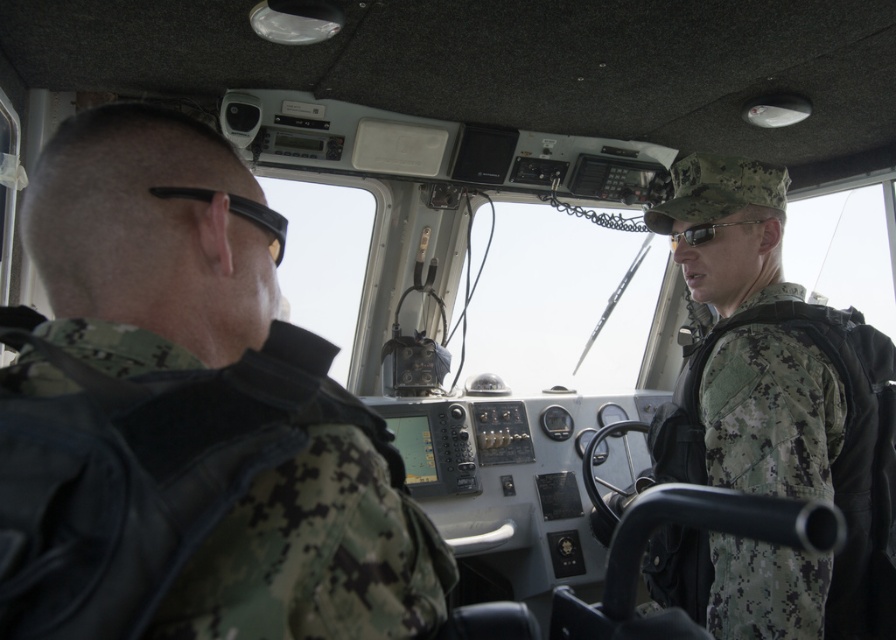
Question: Which of these objects is positioned farthest from the sunglasses at center?

Choices:
 (A) black rubber goggles at left
 (B) camouflage uniform at center

Answer: (A)

Question: From the image, what is the correct spatial relationship of camouflage uniform at left in relation to camouflage uniform at center?

Choices:
 (A) below
 (B) above

Answer: (B)

Question: Among these points, which one is nearest to the camera?

Choices:
 (A) (704, 362)
 (B) (274, 236)

Answer: (B)

Question: Which object is positioned closest to the camouflage uniform at center?

Choices:
 (A) camouflage uniform at left
 (B) black rubber goggles at left

Answer: (A)

Question: Is camouflage uniform at left wider than camouflage uniform at center?

Choices:
 (A) yes
 (B) no

Answer: (B)

Question: Is camouflage uniform at left further to camera compared to black rubber goggles at left?

Choices:
 (A) yes
 (B) no

Answer: (B)